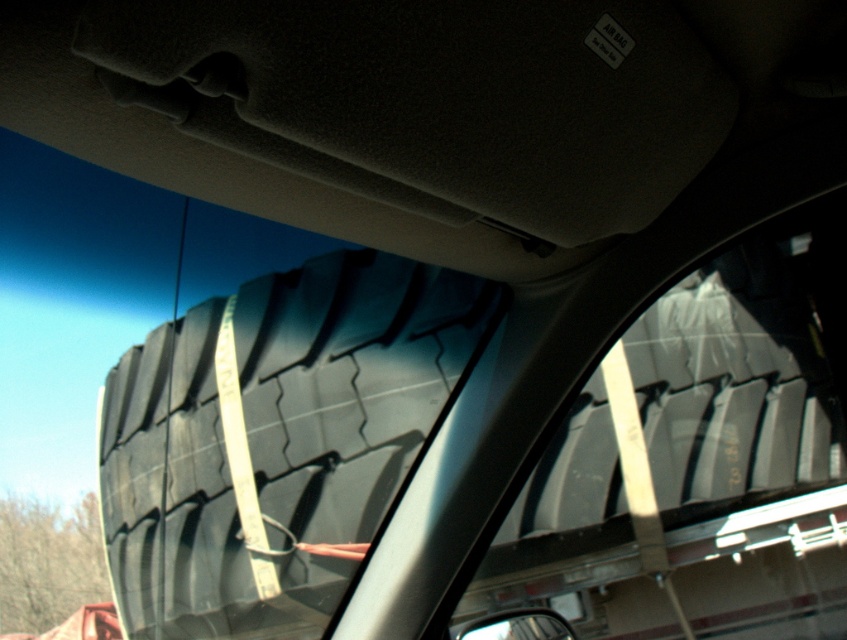
Question: Estimate the real-world distances between objects in this image. Which object is closer to the black rubber tire at center?

Choices:
 (A) transparent plastic window at center
 (B) glossy plastic view mirror at lower center

Answer: (A)

Question: Is transparent plastic window at center to the right of black rubber tire at center from the viewer's perspective?

Choices:
 (A) no
 (B) yes

Answer: (B)

Question: Can you confirm if black rubber tire at center is positioned to the left of glossy plastic view mirror at lower center?

Choices:
 (A) yes
 (B) no

Answer: (A)

Question: Which of the following is the farthest from the observer?

Choices:
 (A) transparent plastic window at center
 (B) black rubber tire at center

Answer: (B)

Question: Which of the following is the closest to the observer?

Choices:
 (A) glossy plastic view mirror at lower center
 (B) transparent plastic window at center

Answer: (A)

Question: Is transparent plastic window at center wider than glossy plastic view mirror at lower center?

Choices:
 (A) no
 (B) yes

Answer: (B)